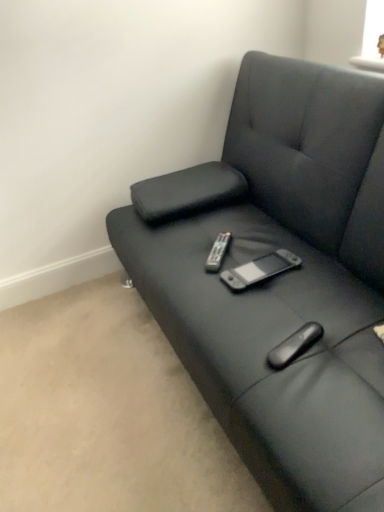
What is the approximate width of black plastic remote at center?

9.00 inches.

Describe the element at coordinates (218, 252) in the screenshot. I see `black plastic remote at center` at that location.

Identify the location of black plastic remote at center. The image size is (384, 512). (218, 252).

Locate an element on the screen. The image size is (384, 512). matte black couch at center is located at coordinates (280, 278).

In order to face matte black couch at center, should I rotate leftwards or rightwards?

A 11.491 degree turn to the right will do.

The height and width of the screenshot is (512, 384). What do you see at coordinates (280, 278) in the screenshot? I see `matte black couch at center` at bounding box center [280, 278].

Where is `black plastic remote at center`? This screenshot has height=512, width=384. black plastic remote at center is located at coordinates (218, 252).

Considering the relative positions of black plastic remote at center and matte black couch at center in the image provided, is black plastic remote at center to the left of matte black couch at center from the viewer's perspective?

Yes, black plastic remote at center is to the left of matte black couch at center.

Which is in front, black plastic remote at center or matte black couch at center?

matte black couch at center is more forward.

Considering the points (224, 236) and (171, 317), which point is in front, point (224, 236) or point (171, 317)?

The point (171, 317) is in front.

From the image's perspective, would you say black plastic remote at center is positioned over matte black couch at center?

No, from the image's perspective, black plastic remote at center is not on top of matte black couch at center.

From a real-world perspective, does black plastic remote at center sit lower than matte black couch at center?

Yes.

Considering the sizes of objects black plastic remote at center and matte black couch at center in the image provided, who is thinner, black plastic remote at center or matte black couch at center?

Thinner between the two is black plastic remote at center.

Is black plastic remote at center taller than matte black couch at center?

No.

Which of these two, black plastic remote at center or matte black couch at center, is bigger?

matte black couch at center is bigger.

Based on the photo, is matte black couch at center completely or partially inside black plastic remote at center?

No, matte black couch at center is not a part of black plastic remote at center.

Is black plastic remote at center next to matte black couch at center and touching it?

black plastic remote at center and matte black couch at center are clearly separated.

Could you tell me if black plastic remote at center is facing matte black couch at center?

Yes, black plastic remote at center faces towards matte black couch at center.

This screenshot has height=512, width=384. I want to click on remote lying behind the matte black couch at center, so click(x=218, y=252).

Visually, is matte black couch at center positioned to the left or to the right of black plastic remote at center?

matte black couch at center is positioned on black plastic remote at center's right side.

Is matte black couch at center closer to camera compared to black plastic remote at center?

Yes, it is in front of black plastic remote at center.

Is point (324, 236) positioned after point (213, 270)?

Yes, it is.

From the image's perspective, between matte black couch at center and black plastic remote at center, which one is located above?

matte black couch at center, from the image's perspective.

From a real-world perspective, is matte black couch at center physically above black plastic remote at center?

Yes, from a real-world perspective, matte black couch at center is on top of black plastic remote at center.

Does matte black couch at center have a lesser width compared to black plastic remote at center?

In fact, matte black couch at center might be wider than black plastic remote at center.

From the picture: Considering the sizes of objects matte black couch at center and black plastic remote at center in the image provided, who is shorter, matte black couch at center or black plastic remote at center?

With less height is black plastic remote at center.

Between matte black couch at center and black plastic remote at center, which one has smaller size?

black plastic remote at center is smaller.

Is matte black couch at center inside the boundaries of black plastic remote at center, or outside?

matte black couch at center lies outside black plastic remote at center.

Consider the image. Is matte black couch at center directly adjacent to black plastic remote at center?

No, matte black couch at center is not making contact with black plastic remote at center.

Could you tell me if matte black couch at center is facing black plastic remote at center?

Yes, matte black couch at center is turned towards black plastic remote at center.

How many degrees apart are the facing directions of matte black couch at center and black plastic remote at center?

There is a 49.4-degree angle between the facing directions of matte black couch at center and black plastic remote at center.

This screenshot has width=384, height=512. In order to click on studio couch on the right side of black plastic remote at center in this screenshot , I will do `click(280, 278)`.

Locate an element on the screen. This screenshot has width=384, height=512. remote below the matte black couch at center (from a real-world perspective) is located at coordinates (218, 252).

At what (x,y) coordinates should I click in order to perform the action: click on remote on the left of the matte black couch at center. Please return your answer as a coordinate pair (x, y). Looking at the image, I should click on (218, 252).